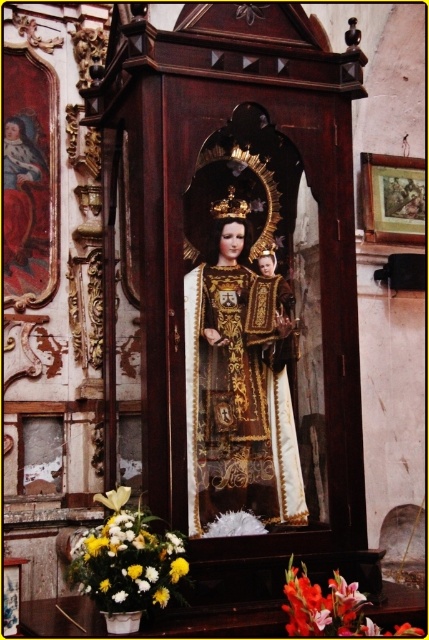
Which is above, white floral arrangement at lower left or smooth orange gladiolus at lower center?

white floral arrangement at lower left is above.

Can you confirm if white floral arrangement at lower left is positioned to the left of smooth orange gladiolus at lower center?

Yes, white floral arrangement at lower left is to the left of smooth orange gladiolus at lower center.

Does point (129, 541) lie behind point (390, 632)?

No, (129, 541) is in front of (390, 632).

Where is `white floral arrangement at lower left`? white floral arrangement at lower left is located at coordinates (126, 560).

Is white floral arrangement at lower left thinner than yellow matte flower at lower left?

In fact, white floral arrangement at lower left might be wider than yellow matte flower at lower left.

Is white floral arrangement at lower left to the left of yellow matte flower at lower left from the viewer's perspective?

No, white floral arrangement at lower left is not to the left of yellow matte flower at lower left.

Describe the element at coordinates (126, 560) in the screenshot. The height and width of the screenshot is (640, 429). I see `white floral arrangement at lower left` at that location.

I want to click on white floral arrangement at lower left, so click(126, 560).

Can you confirm if smooth orange gladiolus at lower center is bigger than yellow matte flower at lower left?

Incorrect, smooth orange gladiolus at lower center is not larger than yellow matte flower at lower left.

Is smooth orange gladiolus at lower center to the left of yellow matte flower at lower left from the viewer's perspective?

In fact, smooth orange gladiolus at lower center is to the right of yellow matte flower at lower left.

The image size is (429, 640). What do you see at coordinates (331, 608) in the screenshot?
I see `smooth orange gladiolus at lower center` at bounding box center [331, 608].

In order to click on smooth orange gladiolus at lower center in this screenshot , I will do `click(331, 608)`.